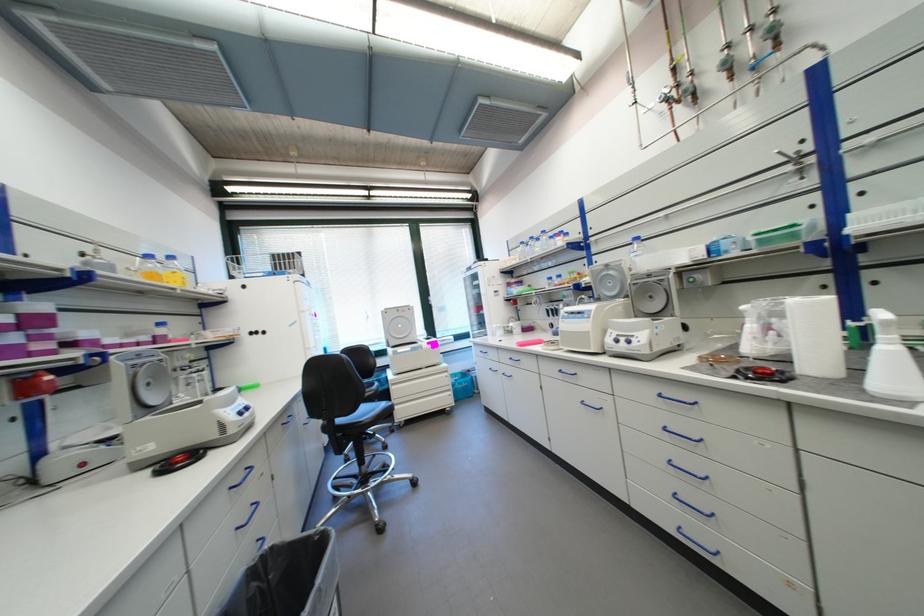
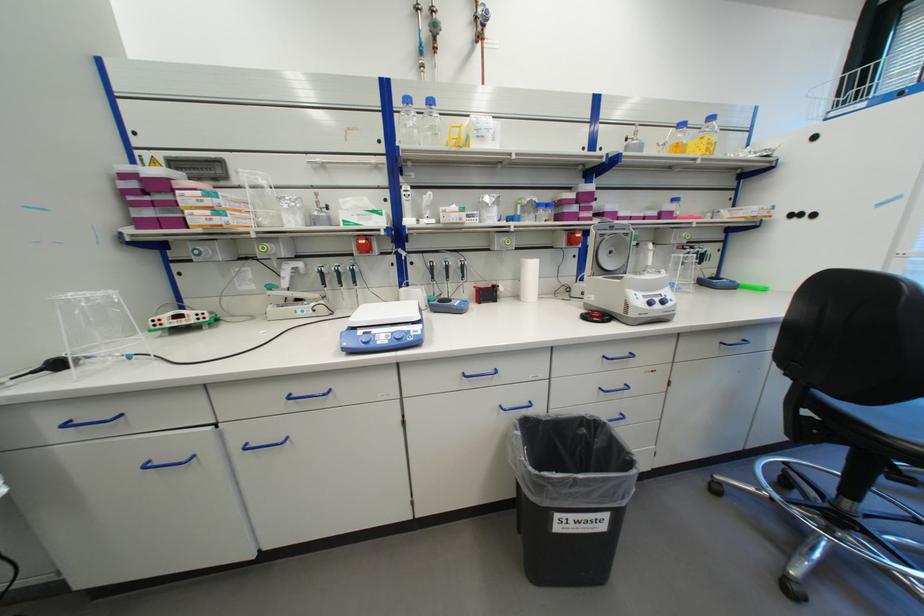
Find the pixel in the second image that matches [44,378] in the first image.

(581, 235)